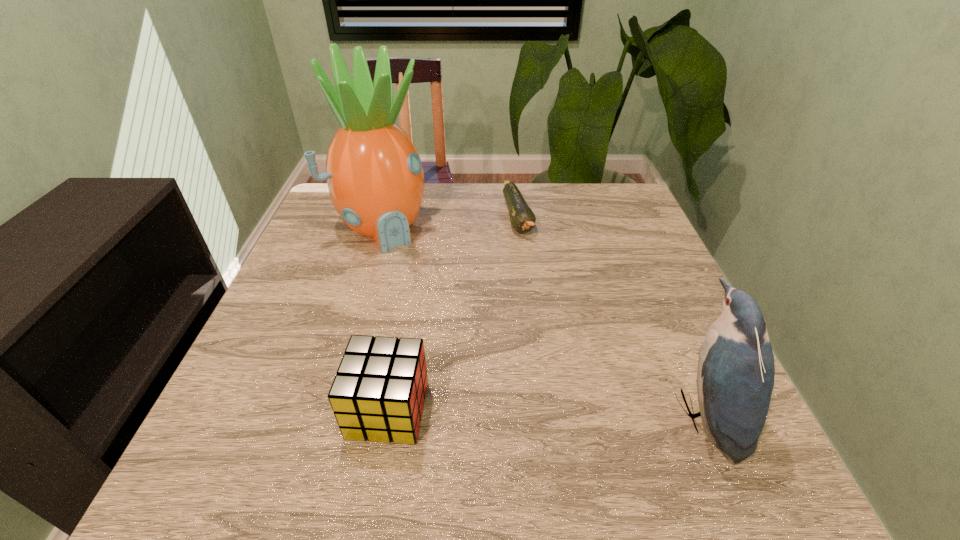
Where is `object that is at the left edge`? Image resolution: width=960 pixels, height=540 pixels. object that is at the left edge is located at coordinates (374, 174).

At what (x,y) coordinates should I click in order to perform the action: click on object positioned at the right edge. Please return your answer as a coordinate pair (x, y). Looking at the image, I should click on (735, 378).

The image size is (960, 540). What are the coordinates of `object positioned at the far left corner` in the screenshot? It's located at (374, 174).

This screenshot has width=960, height=540. Identify the location of object at the near right corner. (735, 378).

Find the location of `blank space at the far edge of the desktop`. blank space at the far edge of the desktop is located at coordinates (508, 224).

In the image, there is a desktop. Where is `vacant space at the near edge`? The width and height of the screenshot is (960, 540). vacant space at the near edge is located at coordinates (641, 399).

Where is `free space at the left edge`? free space at the left edge is located at coordinates (334, 295).

Locate an element on the screen. This screenshot has height=540, width=960. vacant space at the right edge is located at coordinates (617, 266).

This screenshot has height=540, width=960. In the image, there is a desktop. Find the location of `vacant space at the far left corner`. vacant space at the far left corner is located at coordinates (334, 209).

In the image, there is a desktop. Where is `vacant space at the far right corner`? vacant space at the far right corner is located at coordinates (596, 203).